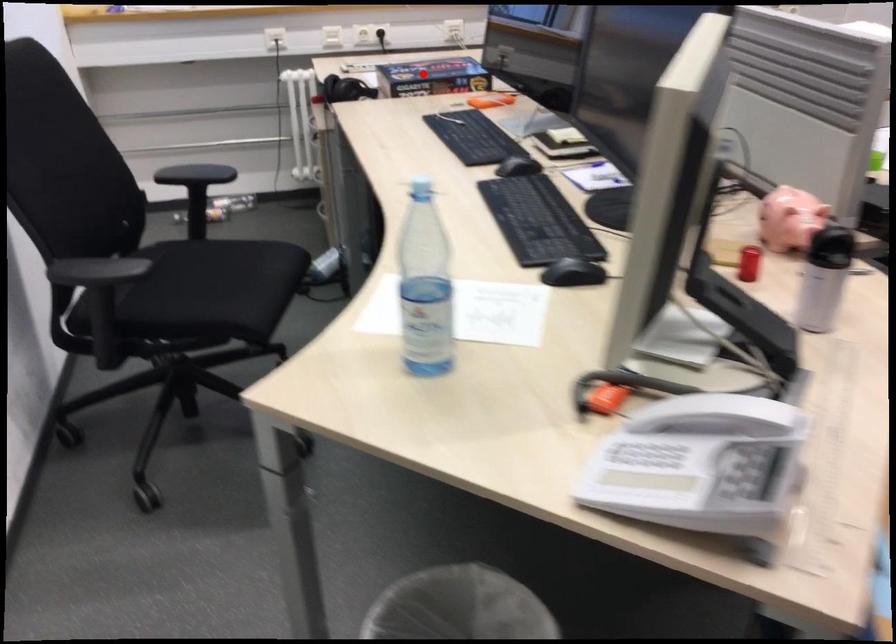
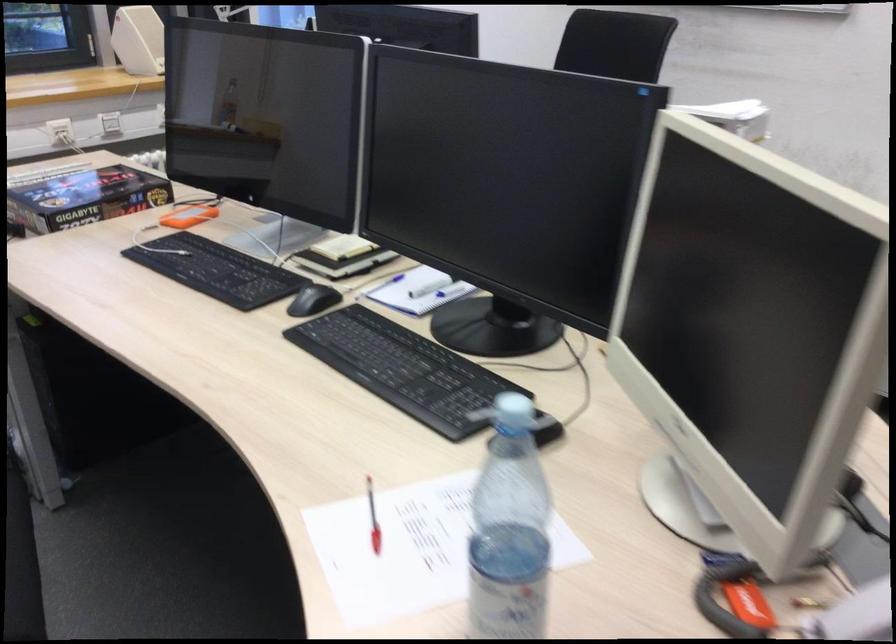
Question: I am providing you with two images of the same scene from different viewpoints. A red point is shown in image1. For the corresponding object point in image2, is it positioned nearer or farther from the camera?

Choices:
 (A) Nearer
 (B) Farther

Answer: (A)